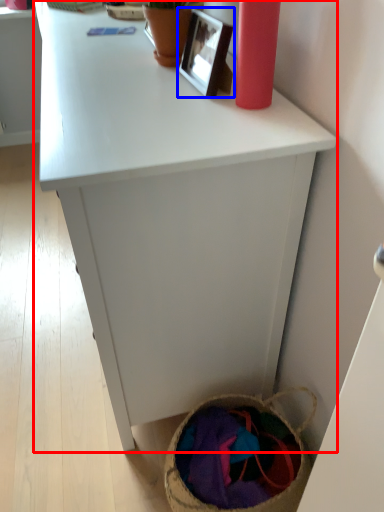
Question: Which object is closer to the camera taking this photo, desk (highlighted by a red box) or picture frame (highlighted by a blue box)?

Choices:
 (A) desk
 (B) picture frame

Answer: (A)